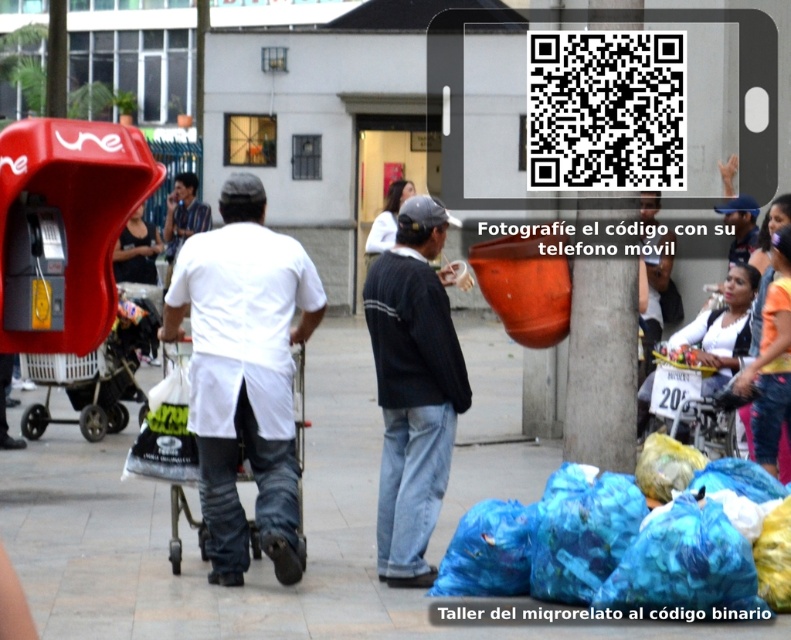
Which is behind, point (407, 545) or point (664, 241)?

Point (664, 241)

Between dark blue sweater at center and dark blue jeans at lower right, which one appears on the right side from the viewer's perspective?

dark blue jeans at lower right is more to the right.

Who is more forward, (398, 456) or (642, 321)?

Positioned in front is point (398, 456).

You are a GUI agent. You are given a task and a screenshot of the screen. Output one action in this format:
    pyautogui.click(x=<x>, y=<y>)
    Task: Click on the dark blue sweater at center
    The image size is (791, 640).
    Given the screenshot: What is the action you would take?
    pyautogui.click(x=413, y=388)

Is blue plastic bags at lower center wider than blue denim jacket at upper right?

Yes, blue plastic bags at lower center is wider than blue denim jacket at upper right.

Can you confirm if blue plastic bags at lower center is positioned above blue denim jacket at upper right?

No.

Who is more forward, (210, 598) or (746, 243)?

Point (210, 598)

You are a GUI agent. You are given a task and a screenshot of the screen. Output one action in this format:
    pyautogui.click(x=<x>, y=<y>)
    Task: Click on the blue plastic bags at lower center
    
    Given the screenshot: What is the action you would take?
    pyautogui.click(x=252, y=561)

Does point (744, 632) come farther from viewer compared to point (434, 412)?

No, it is in front of (434, 412).

Does blue plastic bags at lower center come in front of dark blue sweater at center?

Yes, it is.

Who is more distant from viewer, [184,621] or [407,308]?

Point [407,308]

The image size is (791, 640). I want to click on blue plastic bags at lower center, so click(252, 561).